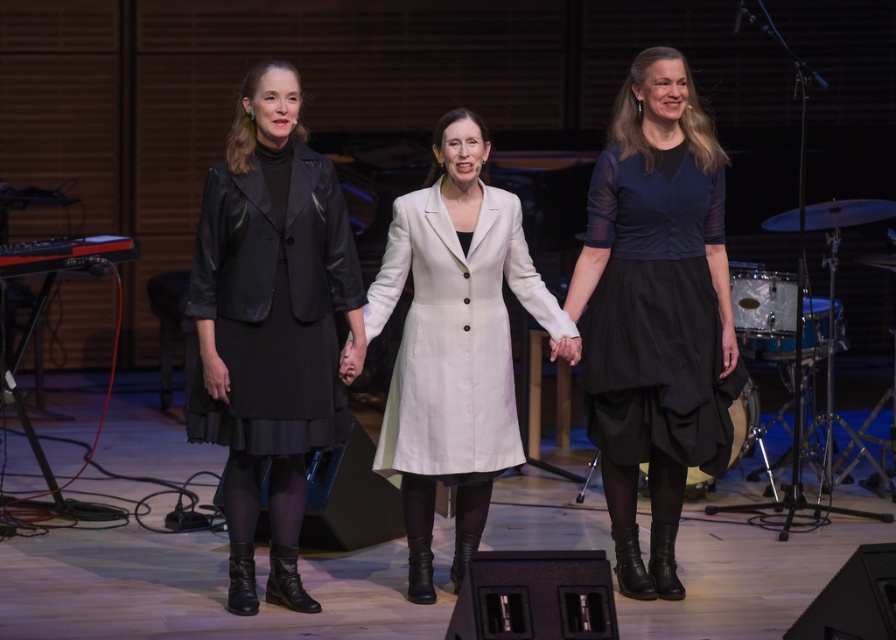
Between black leather jacket at center and matte black dress at right, which one is positioned higher?

matte black dress at right is higher up.

Between black leather jacket at center and matte black dress at right, which one has more height?

black leather jacket at center is taller.

What do you see at coordinates (271, 324) in the screenshot? I see `black leather jacket at center` at bounding box center [271, 324].

Locate an element on the screen. The image size is (896, 640). black leather jacket at center is located at coordinates (271, 324).

Between black leather jacket at center and white fabric coat at center, which one appears on the right side from the viewer's perspective?

white fabric coat at center

Who is more forward, (231, 230) or (412, 321)?

Positioned in front is point (231, 230).

You are a GUI agent. You are given a task and a screenshot of the screen. Output one action in this format:
    pyautogui.click(x=<x>, y=<y>)
    Task: Click on the black leather jacket at center
    This screenshot has width=896, height=640.
    Given the screenshot: What is the action you would take?
    pyautogui.click(x=271, y=324)

Can you confirm if matte black dress at right is positioned to the right of white fabric coat at center?

Yes, matte black dress at right is to the right of white fabric coat at center.

Which is more to the right, matte black dress at right or white fabric coat at center?

From the viewer's perspective, matte black dress at right appears more on the right side.

Which is behind, point (675, 296) or point (426, 307)?

Positioned behind is point (675, 296).

This screenshot has height=640, width=896. I want to click on matte black dress at right, so click(655, 314).